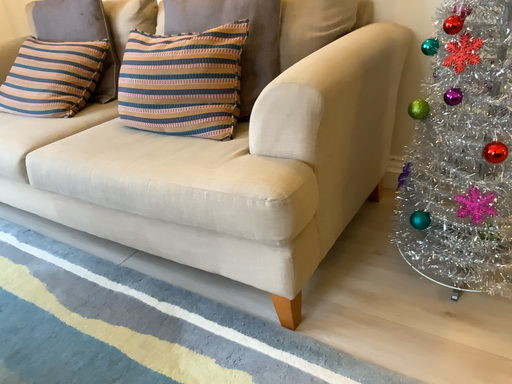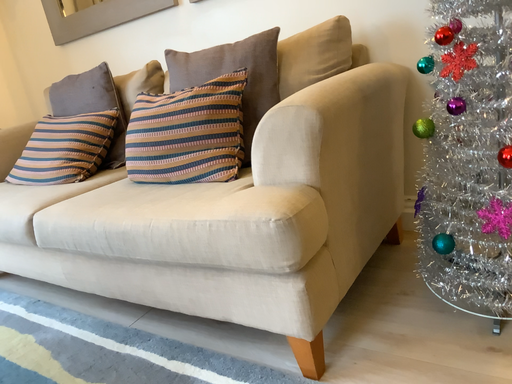
Question: How did the camera likely rotate when shooting the video?

Choices:
 (A) rotated downward
 (B) rotated upward

Answer: (B)